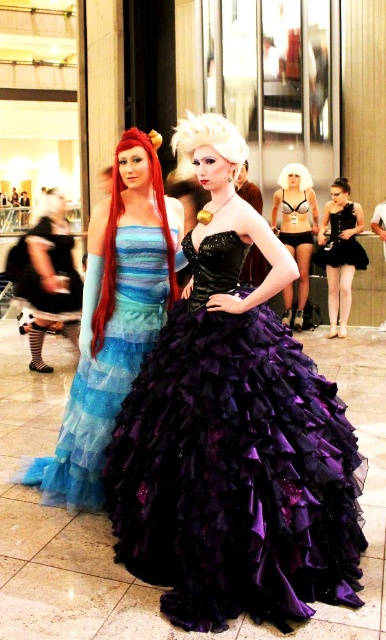
Which is more to the right, shiny red wig at left or white shiny wig at center?

From the viewer's perspective, white shiny wig at center appears more on the right side.

Describe the element at coordinates (116, 228) in the screenshot. I see `shiny red wig at left` at that location.

Is point (169, 289) less distant than point (186, 170)?

Yes, it is in front of point (186, 170).

Locate an element on the screen. The width and height of the screenshot is (386, 640). shiny red wig at left is located at coordinates (116, 228).

Is shiny red wig at left smaller than black satin dress at center?

No, shiny red wig at left is not smaller than black satin dress at center.

Is shiny red wig at left positioned at the back of black satin dress at center?

No, it is not.

Does point (111, 228) come behind point (353, 262)?

No, (111, 228) is in front of (353, 262).

This screenshot has height=640, width=386. Identify the location of shiny red wig at left. (116, 228).

Does point (350, 248) come in front of point (338, 225)?

Yes, it is.

Which of these two, matte black bodysuit at center or black satin dress at center, stands shorter?

black satin dress at center

Which is behind, point (352, 230) or point (353, 244)?

Point (353, 244)

Find the location of a particular element. This screenshot has height=640, width=386. matte black bodysuit at center is located at coordinates (340, 257).